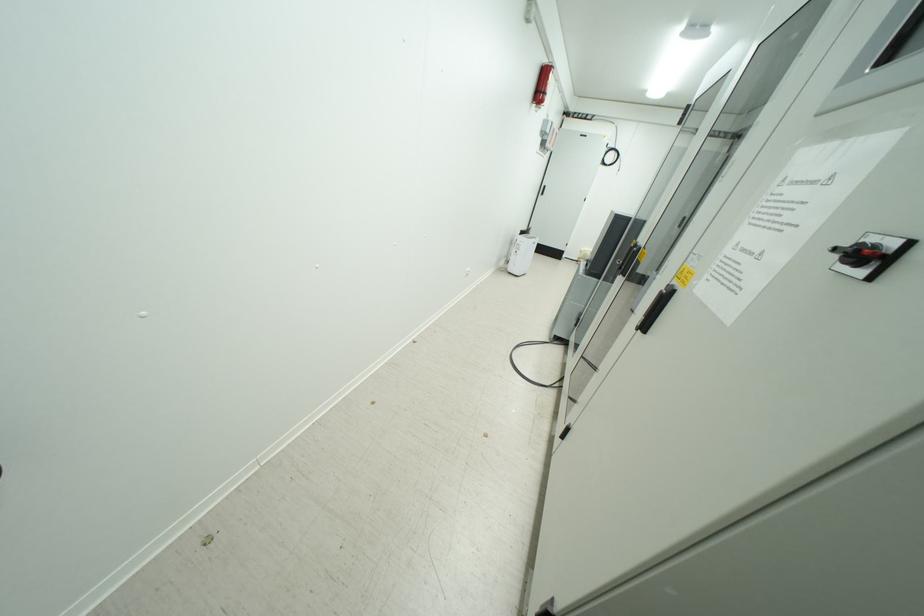
Describe the element at coordinates (658, 307) in the screenshot. I see `the black door handle` at that location.